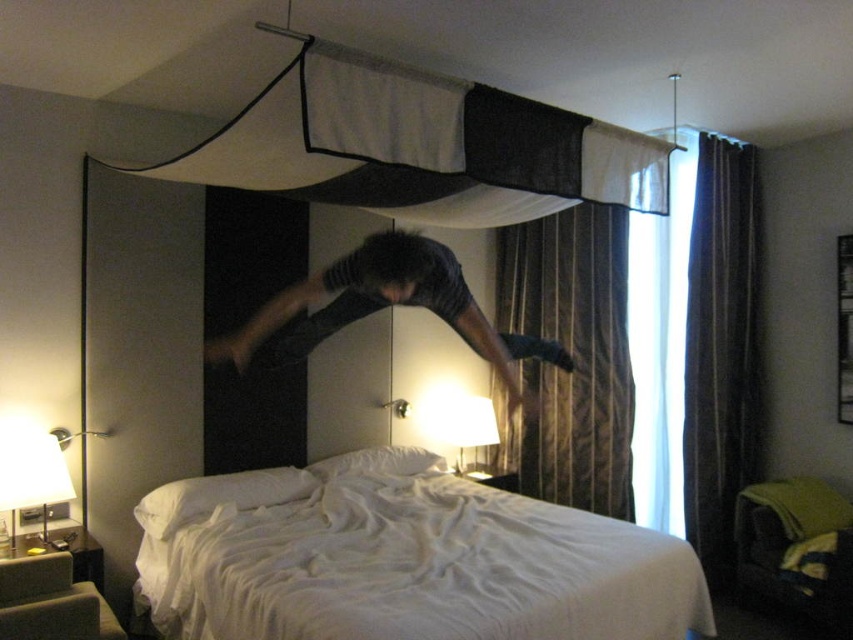
Measure the distance from white soft bed at center to dark fabric curtain at right.

white soft bed at center and dark fabric curtain at right are 1.70 meters apart.

Who is higher up, white soft bed at center or dark fabric curtain at right?

dark fabric curtain at right is higher up.

Is point (648, 556) behind point (727, 285)?

No.

In order to click on white soft bed at center in this screenshot , I will do `click(402, 560)`.

You are a GUI agent. You are given a task and a screenshot of the screen. Output one action in this format:
    pyautogui.click(x=<x>, y=<y>)
    Task: Click on the white fabric canopy at upper center
    Image resolution: width=853 pixels, height=640 pixels.
    Given the screenshot: What is the action you would take?
    pyautogui.click(x=418, y=145)

This screenshot has width=853, height=640. What do you see at coordinates (418, 145) in the screenshot? I see `white fabric canopy at upper center` at bounding box center [418, 145].

The image size is (853, 640). What do you see at coordinates (418, 145) in the screenshot? I see `white fabric canopy at upper center` at bounding box center [418, 145].

At what (x,y) coordinates should I click in order to perform the action: click on white fabric canopy at upper center. Please return your answer as a coordinate pair (x, y). Looking at the image, I should click on tap(418, 145).

Is point (358, 74) farther from viewer compared to point (485, 346)?

No, (358, 74) is in front of (485, 346).

Who is taller, white fabric canopy at upper center or dark gray fabric at center?

dark gray fabric at center

Between point (503, 224) and point (543, 340), which one is positioned in front?

Positioned in front is point (543, 340).

What are the coordinates of `white fabric canopy at upper center` in the screenshot? It's located at (418, 145).